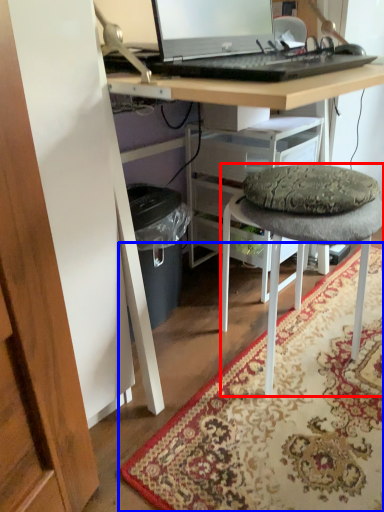
Question: Which point is further to the camera, stool (highlighted by a red box) or mat (highlighted by a blue box)?

Choices:
 (A) stool
 (B) mat

Answer: (A)